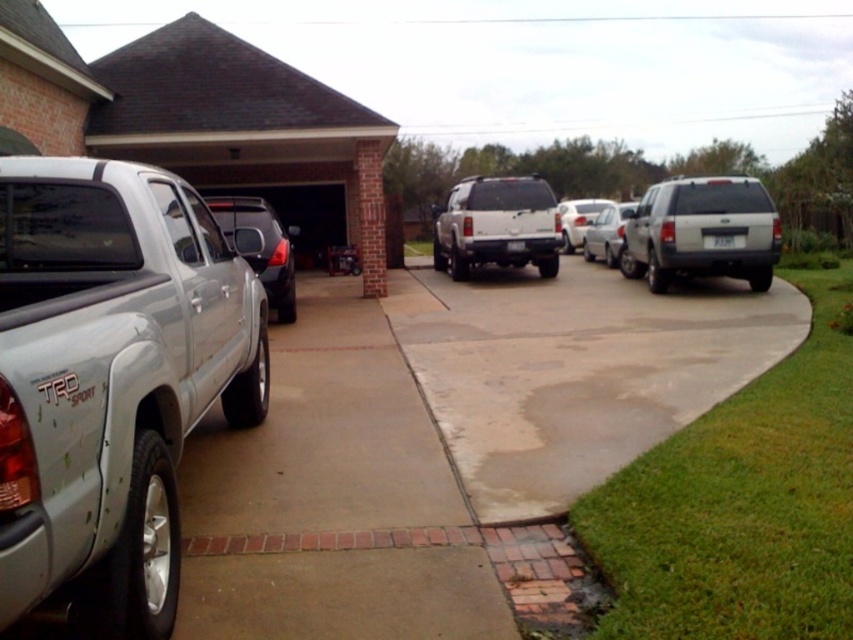
Question: Considering the real-world distances, which object is farthest from the silver metallic truck at left?

Choices:
 (A) satin silver suv at center
 (B) satin black suv at center
 (C) white glossy sedan at center

Answer: (C)

Question: Estimate the real-world distances between objects in this image. Which object is closer to the white glossy sedan at center?

Choices:
 (A) silver metallic truck at left
 (B) silver metallic suv at right

Answer: (B)

Question: Can you confirm if gray concrete pavement at lower left is positioned below satin silver suv at center?

Choices:
 (A) no
 (B) yes

Answer: (B)

Question: Can you confirm if silver metallic sedan at center-right is wider than white glossy sedan at center?

Choices:
 (A) yes
 (B) no

Answer: (B)

Question: Which of the following is the closest to the observer?

Choices:
 (A) (595, 212)
 (B) (265, 237)
 (C) (96, 275)
 (D) (730, 364)

Answer: (C)

Question: Is concrete at center closer to camera compared to satin black suv at center?

Choices:
 (A) yes
 (B) no

Answer: (A)